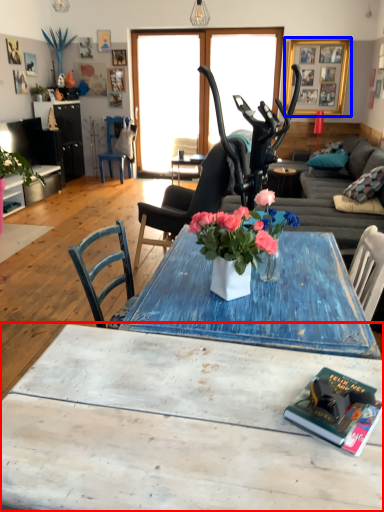
Question: Which of the following is the closest to the observer, coffee table (highlighted by a red box) or picture frame (highlighted by a blue box)?

Choices:
 (A) coffee table
 (B) picture frame

Answer: (A)